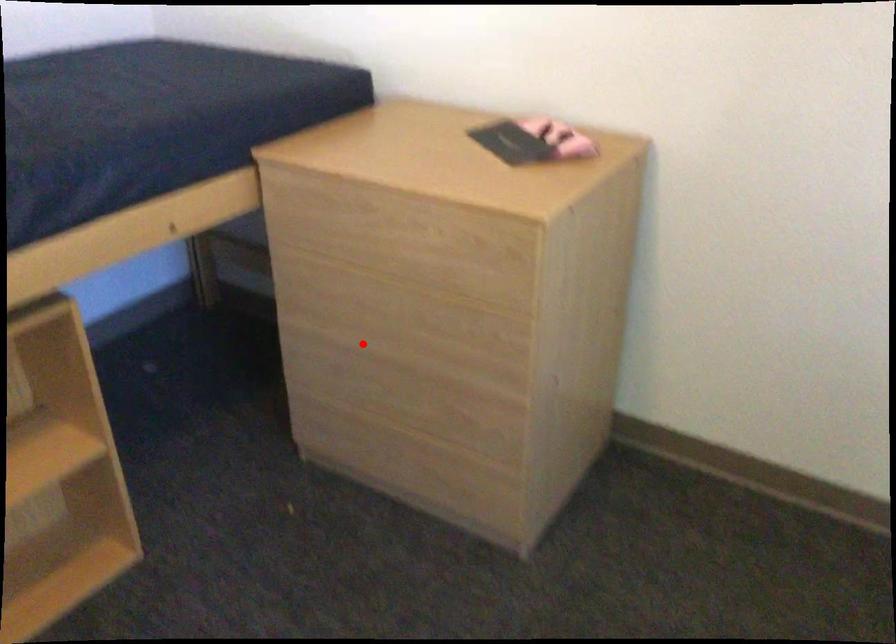
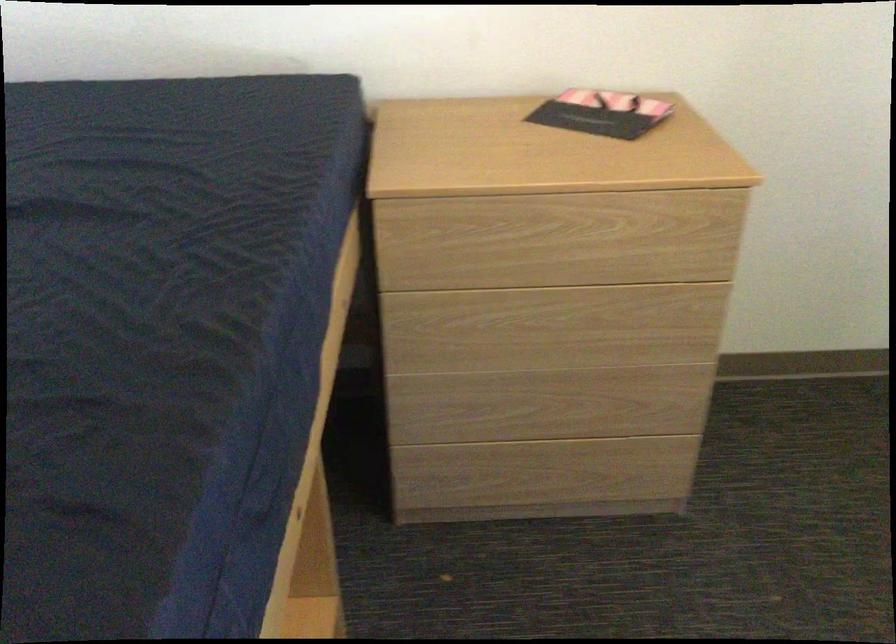
Find the pixel in the second image that matches the highlighted location in the first image.

(518, 368)